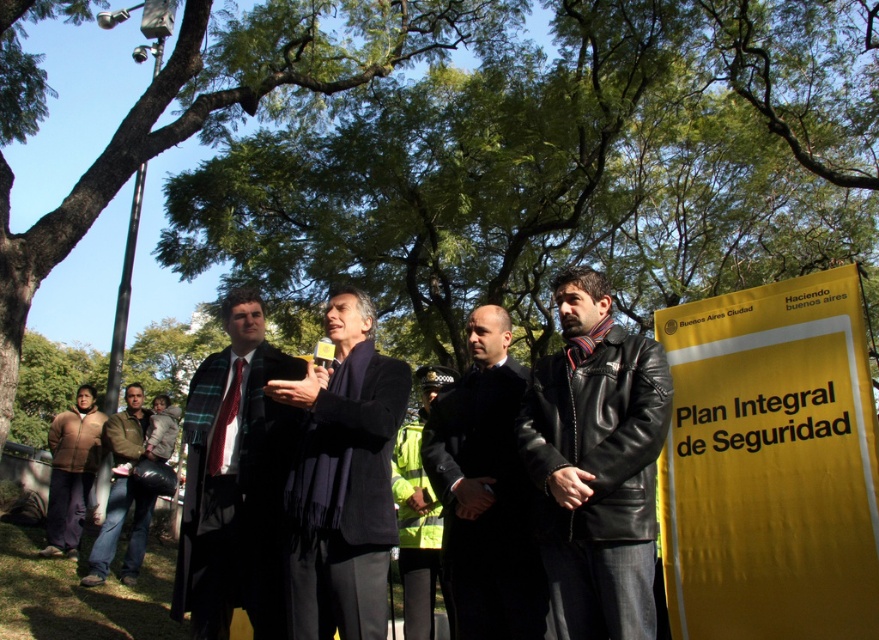
Question: Is yellow paper sign at right thinner than black leather jacket at center?

Choices:
 (A) yes
 (B) no

Answer: (B)

Question: Does plaid wool scarf at center have a larger size compared to reflective yellow jacket at center?

Choices:
 (A) yes
 (B) no

Answer: (A)

Question: Which is farther from the green leafy tree at upper center?

Choices:
 (A) reflective yellow jacket at center
 (B) dark gray wool scarf at center
 (C) brown leather jacket at lower left

Answer: (A)

Question: Among these points, which one is nearest to the camera?

Choices:
 (A) (51, 531)
 (B) (251, 589)
 (C) (456, 592)
 (D) (543, 456)

Answer: (D)

Question: Does green leafy tree at upper center appear on the left side of dark gray wool scarf at center?

Choices:
 (A) yes
 (B) no

Answer: (A)

Question: Which of these objects is positioned closest to the green leafy tree at upper center?

Choices:
 (A) black leather jacket at right
 (B) dark gray wool scarf at center
 (C) brown fuzzy jacket at lower left

Answer: (B)